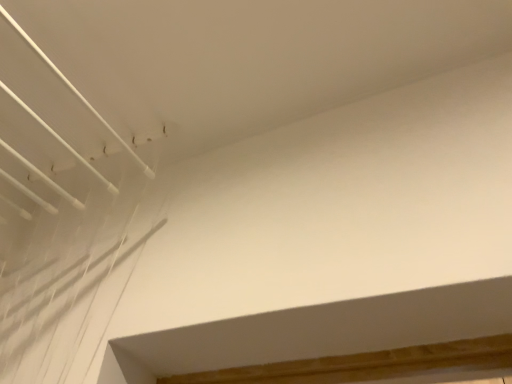
What are the coordinates of `white matte shutter at upper left` in the screenshot? It's located at (62, 198).

What is the approximate height of white matte shutter at upper left?

9.04 inches.

The width and height of the screenshot is (512, 384). Describe the element at coordinates (62, 198) in the screenshot. I see `white matte shutter at upper left` at that location.

This screenshot has width=512, height=384. Identify the location of white matte shutter at upper left. (62, 198).